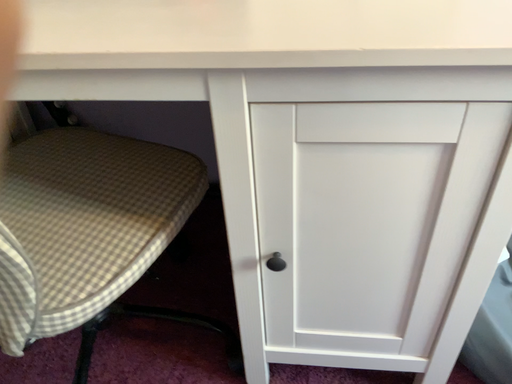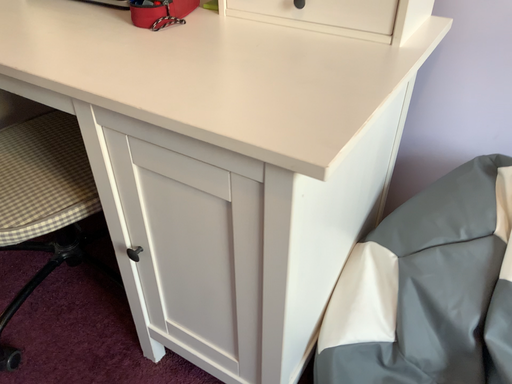
Question: How did the camera likely rotate when shooting the video?

Choices:
 (A) rotated left
 (B) rotated right

Answer: (A)